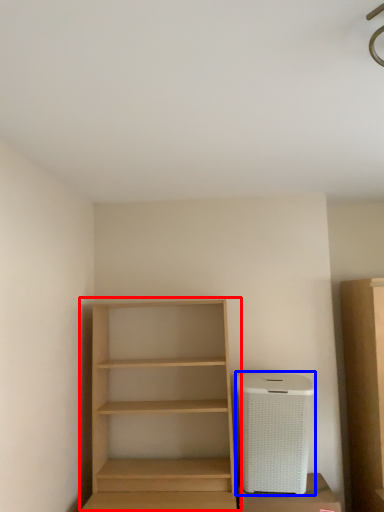
Question: Which object is closer to the camera taking this photo, shelf (highlighted by a red box) or appliance (highlighted by a blue box)?

Choices:
 (A) shelf
 (B) appliance

Answer: (A)